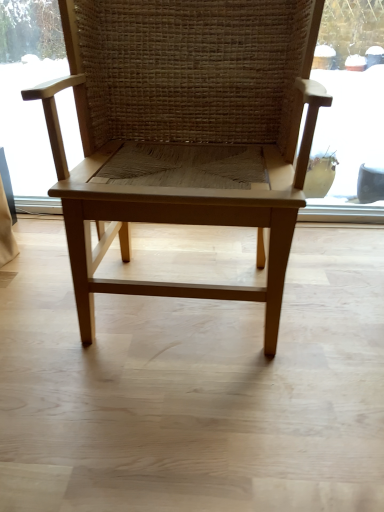
Locate an element on the screen. This screenshot has height=512, width=384. vacant area that lies to the right of light wood chair at center is located at coordinates (335, 287).